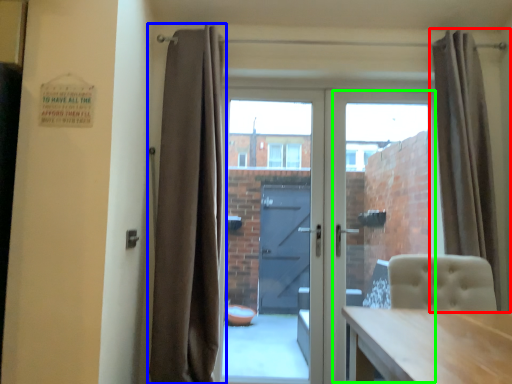
Question: Which object is the farthest from curtain (highlighted by a red box)? Choose among these: curtain (highlighted by a blue box) or glass door (highlighted by a green box).

Choices:
 (A) curtain
 (B) glass door

Answer: (A)